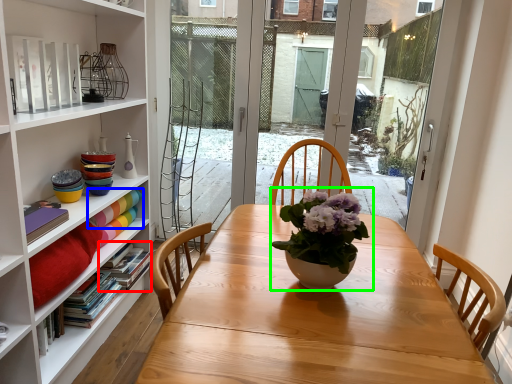
Question: Which object is positioned closest to book (highlighted by a red box)? Select from book (highlighted by a blue box) and houseplant (highlighted by a green box).

Choices:
 (A) book
 (B) houseplant

Answer: (A)